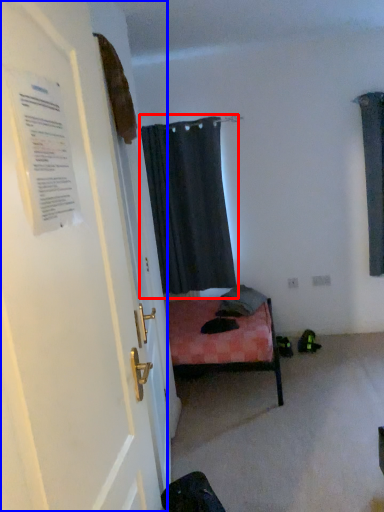
Question: Which point is closer to the camera, curtain (highlighted by a red box) or door (highlighted by a blue box)?

Choices:
 (A) curtain
 (B) door

Answer: (B)